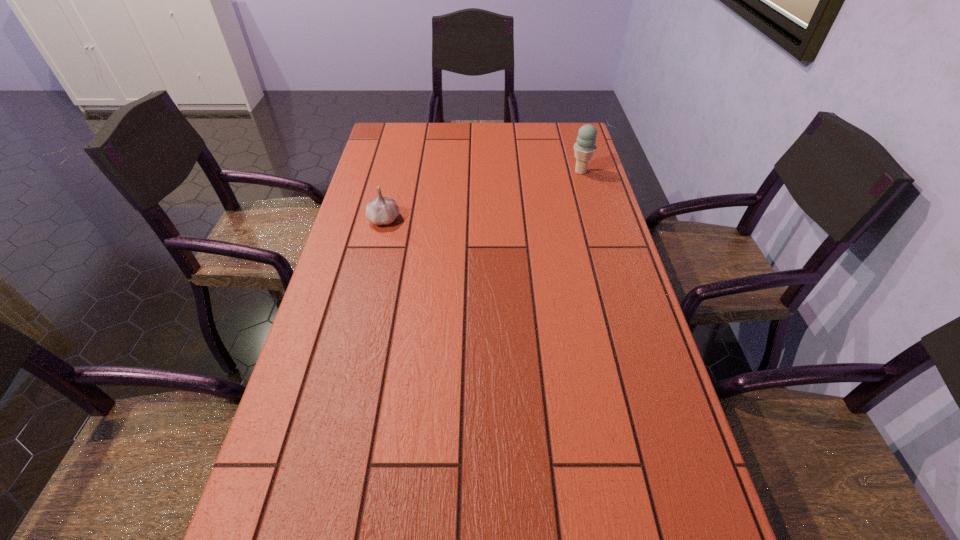
In order to click on ice cream in this screenshot , I will do `click(584, 148)`.

Identify the location of the right object. (584, 148).

The width and height of the screenshot is (960, 540). Find the location of `garlic`. garlic is located at coordinates (382, 210).

You are a GUI agent. You are given a task and a screenshot of the screen. Output one action in this format:
    pyautogui.click(x=<x>, y=<y>)
    Task: Click on the shorter object
    The image size is (960, 540).
    Given the screenshot: What is the action you would take?
    pyautogui.click(x=382, y=210)

The image size is (960, 540). I want to click on free point located on the left of the right object, so click(546, 172).

Locate an element on the screen. This screenshot has height=540, width=960. vacant position located 0.270m on the right of the garlic is located at coordinates (492, 220).

Locate an element on the screen. The width and height of the screenshot is (960, 540). object positioned at the left edge is located at coordinates click(382, 210).

The height and width of the screenshot is (540, 960). What are the coordinates of `object located at the right edge` in the screenshot? It's located at click(x=584, y=148).

At what (x,y) coordinates should I click in order to perform the action: click on free region at the far edge of the desktop. Please return your answer as a coordinate pair (x, y). Looking at the image, I should click on (474, 155).

Identify the location of free space at the left edge of the desktop. This screenshot has width=960, height=540. (321, 377).